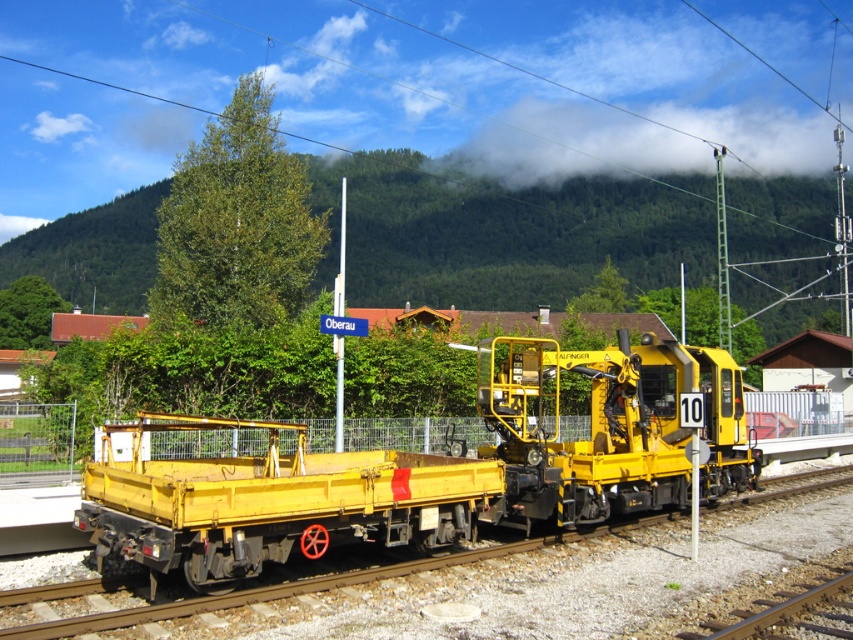
Question: Which point is farther to the camera?

Choices:
 (A) yellow matte train car at center
 (B) matte yellow flatbed at center

Answer: (A)

Question: Which point is farther to the camera?

Choices:
 (A) (628, 410)
 (B) (67, 285)
 (C) (770, 564)

Answer: (B)

Question: Which point is closer to the camera taking this photo?

Choices:
 (A) (274, 520)
 (B) (136, 522)
 (C) (676, 180)

Answer: (B)

Question: Can you confirm if green forested mountain at upper center is wider than yellow metal train track at center?

Choices:
 (A) no
 (B) yes

Answer: (B)

Question: Can you confirm if yellow matte train car at center is thinner than green forested mountain at upper center?

Choices:
 (A) yes
 (B) no

Answer: (A)

Question: Does yellow matte train car at center appear under matte yellow flatbed at center?

Choices:
 (A) yes
 (B) no

Answer: (B)